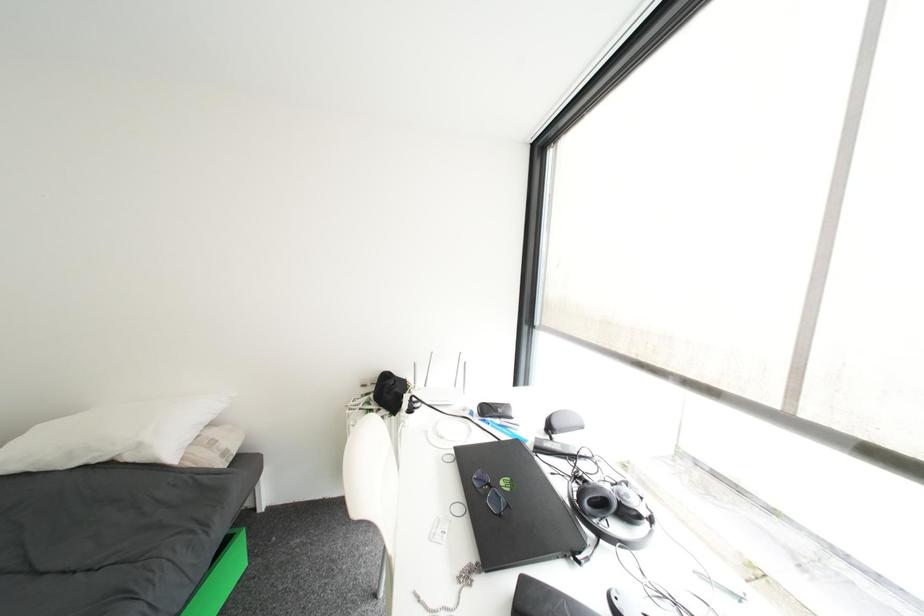
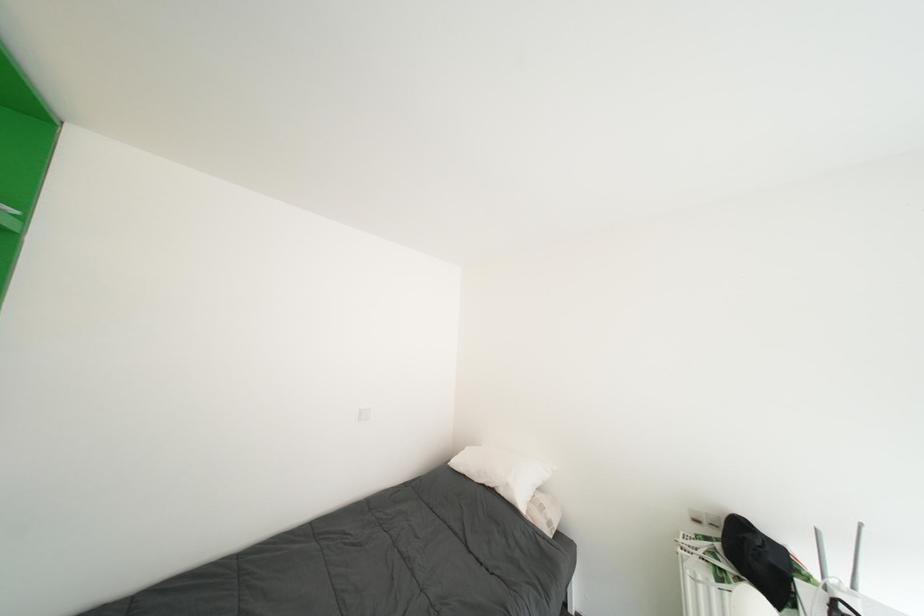
Question: The images are taken continuously from a first-person perspective. In which direction is your viewpoint rotating?

Choices:
 (A) Left
 (B) Right
 (C) Up
 (D) Down

Answer: (A)